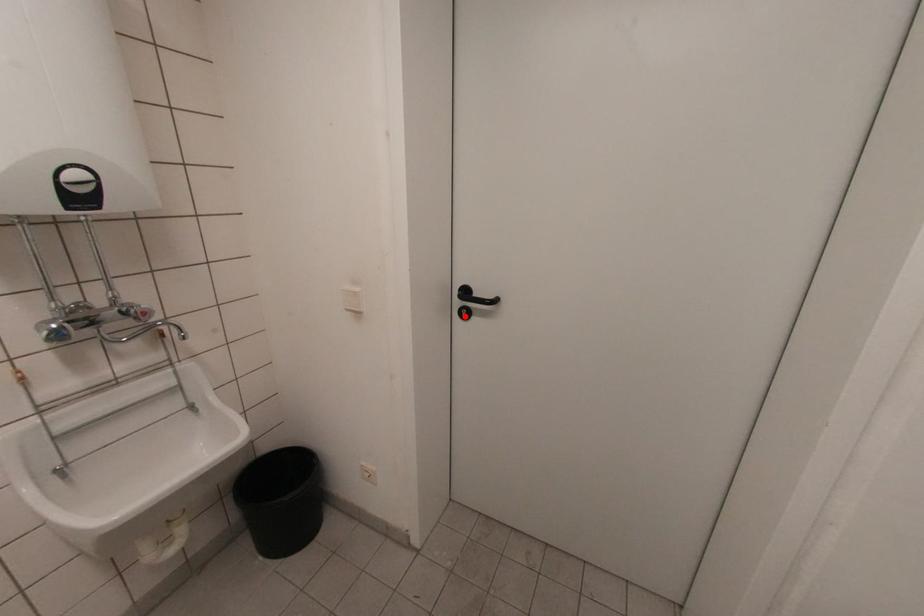
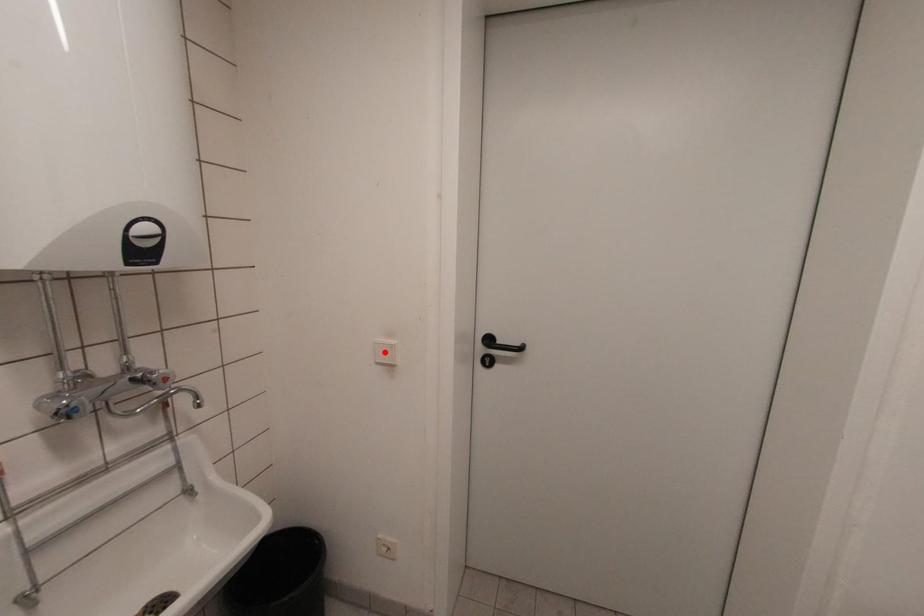
I am providing you with two images of the same scene from different viewpoints. A red point is marked on the first image and another point is marked on the second image. Do the highlighted points in image1 and image2 indicate the same real-world spot?

No